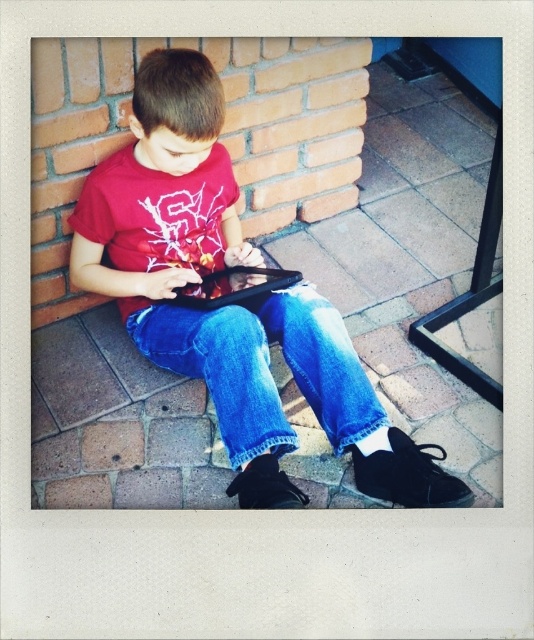
Question: Can you confirm if matte black tablet at center is positioned above denim at center?

Choices:
 (A) yes
 (B) no

Answer: (A)

Question: Which point is farther from the camera taking this photo?

Choices:
 (A) click(x=199, y=269)
 (B) click(x=260, y=272)
 (C) click(x=313, y=305)

Answer: (A)

Question: Does matte black tablet at center have a lesser width compared to black matte tablet at center?

Choices:
 (A) yes
 (B) no

Answer: (B)

Question: Which point is farther to the camera?

Choices:
 (A) (248, 278)
 (B) (242, 340)

Answer: (A)

Question: Which point is farther to the camera?

Choices:
 (A) click(366, 465)
 (B) click(213, 304)

Answer: (B)

Question: Does matte black tablet at center have a larger size compared to denim at center?

Choices:
 (A) yes
 (B) no

Answer: (A)